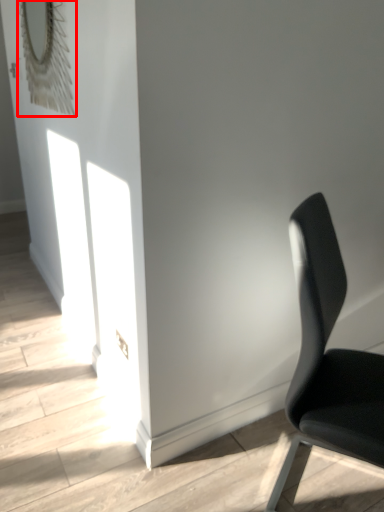
Question: From the image's perspective, what is the correct spatial relationship of mirror (annotated by the red box) in relation to chair?

Choices:
 (A) below
 (B) above

Answer: (B)